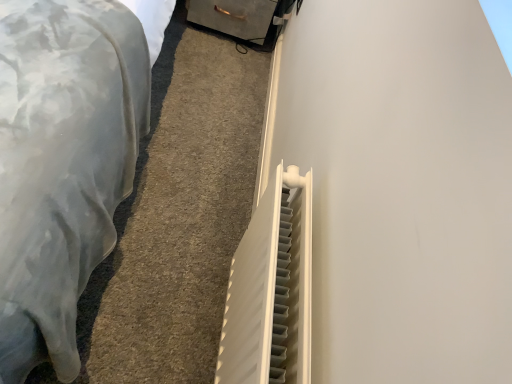
Describe the element at coordinates (234, 17) in the screenshot. The image size is (512, 384). I see `metallic gray drawer at upper center` at that location.

Identify the location of white plastic radiator at lower right. (62, 164).

Locate an element on the screen. This screenshot has height=384, width=512. metallic gray drawer at upper center is located at coordinates (234, 17).

Between metallic gray drawer at upper center and white plastic radiator at lower right, which one appears on the right side from the viewer's perspective?

From the viewer's perspective, metallic gray drawer at upper center appears more on the right side.

Is metallic gray drawer at upper center inside the boundaries of white plastic radiator at lower right, or outside?

metallic gray drawer at upper center exists outside the volume of white plastic radiator at lower right.

Identify the location of furniture in front of the metallic gray drawer at upper center. (62, 164).

From a real-world perspective, is metallic gray drawer at upper center under white plastic radiator at lower right?

No, from a real-world perspective, metallic gray drawer at upper center is not below white plastic radiator at lower right.

Which is correct: white plastic radiator at center-right is inside metallic gray drawer at upper center, or outside of it?

white plastic radiator at center-right is spatially situated outside metallic gray drawer at upper center.

Which is more to the left, white plastic radiator at center-right or metallic gray drawer at upper center?

metallic gray drawer at upper center is more to the left.

From the picture: Does white plastic radiator at center-right lie behind metallic gray drawer at upper center?

No, white plastic radiator at center-right is in front of metallic gray drawer at upper center.

Is white plastic radiator at center-right oriented towards metallic gray drawer at upper center?

No.

Is white plastic radiator at lower right thinner than white plastic radiator at center-right?

In fact, white plastic radiator at lower right might be wider than white plastic radiator at center-right.

Locate an element on the screen. furniture above the white plastic radiator at center-right (from the image's perspective) is located at coordinates (62, 164).

Which object is further away from the camera taking this photo, white plastic radiator at lower right or white plastic radiator at center-right?

white plastic radiator at lower right is further away from the camera.

Who is shorter, white plastic radiator at lower right or white plastic radiator at center-right?

Standing shorter between the two is white plastic radiator at lower right.

Between point (30, 208) and point (251, 24), which one is positioned in front?

The point (30, 208) is in front.

How far apart are white plastic radiator at lower right and metallic gray drawer at upper center?

3.74 feet.

Is metallic gray drawer at upper center located within white plastic radiator at lower right?

No, metallic gray drawer at upper center is not surrounded by white plastic radiator at lower right.

Looking at this image, which object is thinner, white plastic radiator at lower right or metallic gray drawer at upper center?

Thinner between the two is metallic gray drawer at upper center.

Does point (298, 261) lie in front of point (68, 120)?

Yes, point (298, 261) is in front of point (68, 120).

From the picture: Considering the sizes of objects white plastic radiator at center-right and white plastic radiator at lower right in the image provided, who is wider, white plastic radiator at center-right or white plastic radiator at lower right?

Wider between the two is white plastic radiator at lower right.

Is white plastic radiator at center-right touching white plastic radiator at lower right?

No, white plastic radiator at center-right is not in contact with white plastic radiator at lower right.

Is the depth of white plastic radiator at center-right greater than that of white plastic radiator at lower right?

That is False.

This screenshot has height=384, width=512. Identify the location of drawer behind the white plastic radiator at center-right. (234, 17).

Between point (205, 18) and point (221, 358), which one is positioned behind?

The point (205, 18) is more distant.

Consider the image. From a real-world perspective, is metallic gray drawer at upper center above or below white plastic radiator at center-right?

From a real-world perspective, metallic gray drawer at upper center is physically below white plastic radiator at center-right.

Is white plastic radiator at center-right at the back of metallic gray drawer at upper center?

No, metallic gray drawer at upper center is not facing away from white plastic radiator at center-right.

Find the location of `drawer above the white plastic radiator at lower right (from a real-world perspective)`. drawer above the white plastic radiator at lower right (from a real-world perspective) is located at coordinates (234, 17).

Where is `radiator on the right of metallic gray drawer at upper center`? radiator on the right of metallic gray drawer at upper center is located at coordinates 271,289.

Looking at the image, which one is located further to white plastic radiator at lower right, white plastic radiator at center-right or metallic gray drawer at upper center?

metallic gray drawer at upper center is positioned further to the anchor white plastic radiator at lower right.

Which object lies further to the anchor point metallic gray drawer at upper center, white plastic radiator at center-right or white plastic radiator at lower right?

The object further to metallic gray drawer at upper center is white plastic radiator at center-right.

Estimate the real-world distances between objects in this image. Which object is closer to white plastic radiator at center-right, metallic gray drawer at upper center or white plastic radiator at lower right?

white plastic radiator at lower right.

Estimate the real-world distances between objects in this image. Which object is further from white plastic radiator at center-right, white plastic radiator at lower right or metallic gray drawer at upper center?

metallic gray drawer at upper center is further to white plastic radiator at center-right.

From the image, which object appears to be nearer to metallic gray drawer at upper center, white plastic radiator at lower right or white plastic radiator at center-right?

Among the two, white plastic radiator at lower right is located nearer to metallic gray drawer at upper center.

Looking at this image, estimate the real-world distances between objects in this image. Which object is closer to white plastic radiator at lower right, metallic gray drawer at upper center or white plastic radiator at center-right?

white plastic radiator at center-right is closer to white plastic radiator at lower right.

Identify the location of furniture between metallic gray drawer at upper center and white plastic radiator at center-right vertically. Image resolution: width=512 pixels, height=384 pixels. (62, 164).